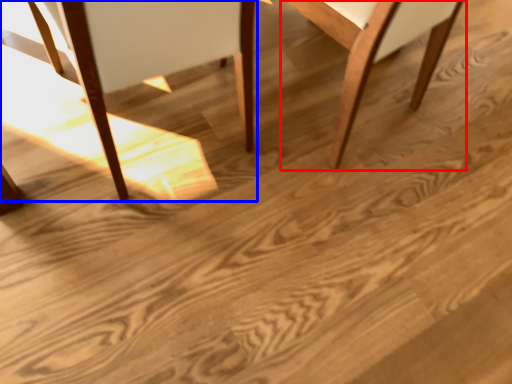
Question: Which of the following is the farthest to the observer, chair (highlighted by a red box) or chair (highlighted by a blue box)?

Choices:
 (A) chair
 (B) chair

Answer: (A)